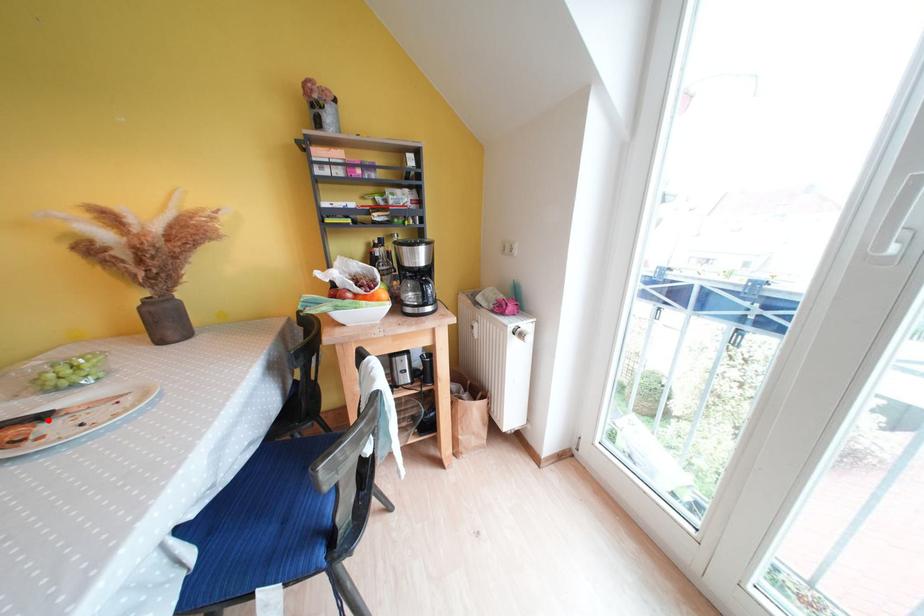
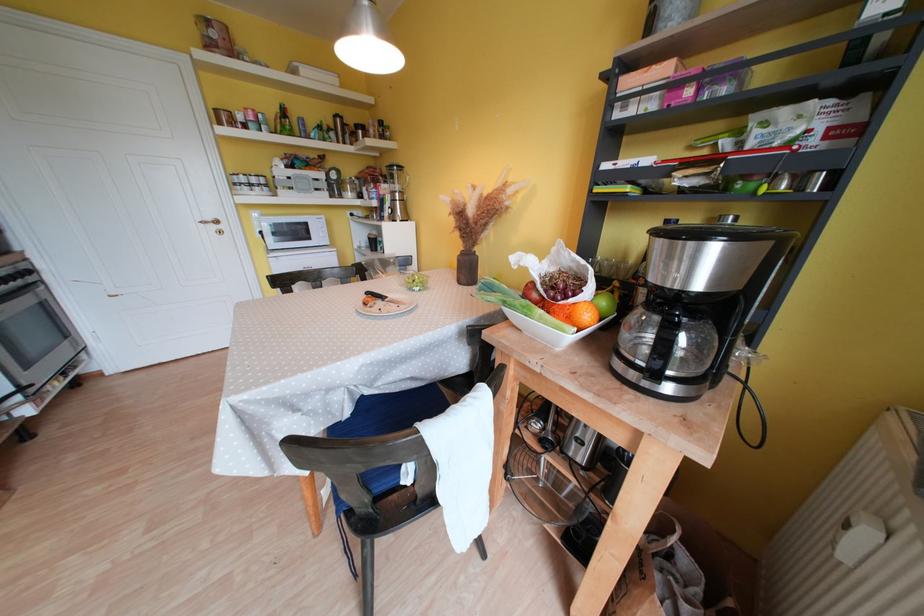
Question: A red point is marked in image1. In image2, is the corresponding 3D point closer to the camera or farther? Reply with the corresponding letter.

Choices:
 (A) The corresponding 3D point is closer.
 (B) The corresponding 3D point is farther.

Answer: (B)